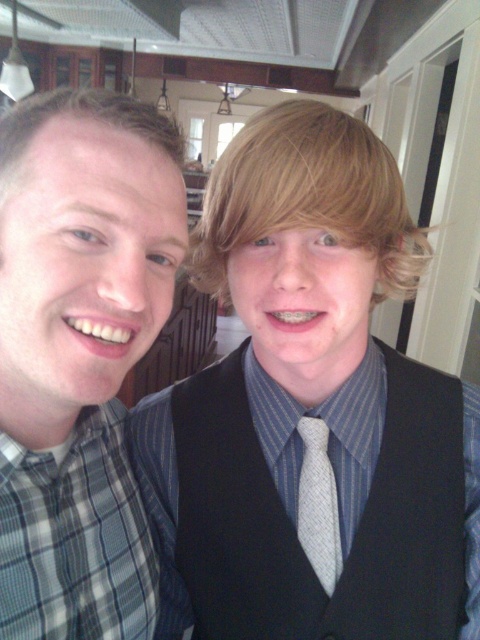
Question: Which point is closer to the camera?

Choices:
 (A) (317, 538)
 (B) (212, 456)

Answer: (A)

Question: Is matte black vest at center below plaid shirt at left?

Choices:
 (A) yes
 (B) no

Answer: (A)

Question: From the image, what is the correct spatial relationship of matte black vest at center in relation to light gray textured tie at center?

Choices:
 (A) right
 (B) left

Answer: (B)

Question: Among these objects, which one is farthest from the camera?

Choices:
 (A) plaid shirt at left
 (B) light gray textured tie at center
 (C) matte black vest at center

Answer: (B)

Question: Does matte black vest at center have a greater width compared to light gray textured tie at center?

Choices:
 (A) yes
 (B) no

Answer: (A)

Question: Which object is the farthest from the matte black vest at center?

Choices:
 (A) plaid shirt at left
 (B) light gray textured tie at center

Answer: (B)